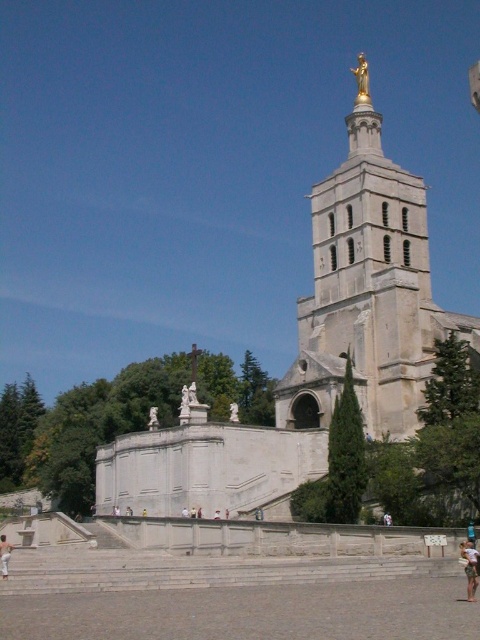
Between white stone church at center and light brown wooden surfboard at lower right, which one has more height?

Standing taller between the two is white stone church at center.

Between point (205, 410) and point (470, 593), which one is positioned behind?

Point (205, 410)

Does point (323, 403) come behind point (470, 579)?

Yes, it is behind point (470, 579).

Locate an element on the screen. white stone church at center is located at coordinates (311, 355).

Can you confirm if light brown wooden surfboard at lower right is bigger than white stone statue at center?

Yes, light brown wooden surfboard at lower right is bigger than white stone statue at center.

Who is shorter, light brown wooden surfboard at lower right or white stone statue at center?

white stone statue at center is shorter.

Is point (465, 564) behind point (219, 516)?

No, (465, 564) is in front of (219, 516).

At what (x,y) coordinates should I click in order to perform the action: click on light brown wooden surfboard at lower right. Please return your answer as a coordinate pair (x, y). Image resolution: width=480 pixels, height=640 pixels. Looking at the image, I should click on (469, 566).

Who is higher up, white stone church at center or gold metallic statue at upper center?

gold metallic statue at upper center is above.

Does white stone church at center have a smaller size compared to gold metallic statue at upper center?

Actually, white stone church at center might be larger than gold metallic statue at upper center.

Find the location of a particular element. The width and height of the screenshot is (480, 640). white stone church at center is located at coordinates (311, 355).

Where is `white stone church at center`? white stone church at center is located at coordinates (311, 355).